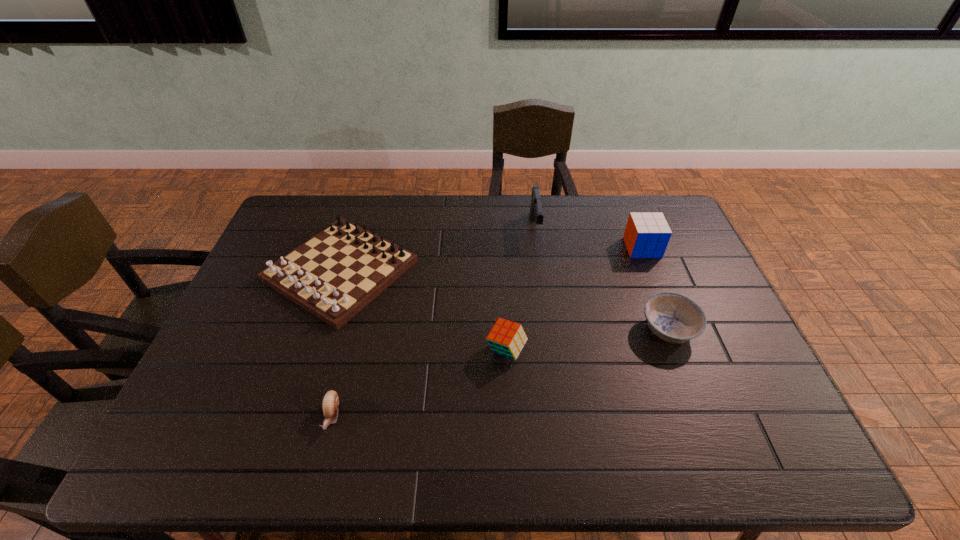
I want to click on object positioned at the far left corner, so click(x=335, y=274).

Identify the location of free space at the far edge of the desktop. (595, 208).

Locate an element on the screen. The image size is (960, 540). vacant space at the near edge is located at coordinates (635, 464).

Identify the location of vacant space at the left edge of the desktop. (273, 313).

In order to click on vacant space at the right edge in this screenshot , I will do `click(752, 386)`.

At what (x,y) coordinates should I click in order to perform the action: click on free point between the fourth object from right to left and the third object from right to left. Please return your answer as a coordinate pair (x, y). Looking at the image, I should click on (521, 289).

Find the location of a particular element. This screenshot has width=960, height=540. free area in between the right cube and the third object from left to right is located at coordinates (574, 299).

I want to click on free spot between the left cube and the bowl, so click(x=588, y=340).

Image resolution: width=960 pixels, height=540 pixels. I want to click on free space between the shortest object and the right cube, so click(x=487, y=332).

Where is `free spot between the bowl and the farther cube`? The image size is (960, 540). free spot between the bowl and the farther cube is located at coordinates (656, 288).